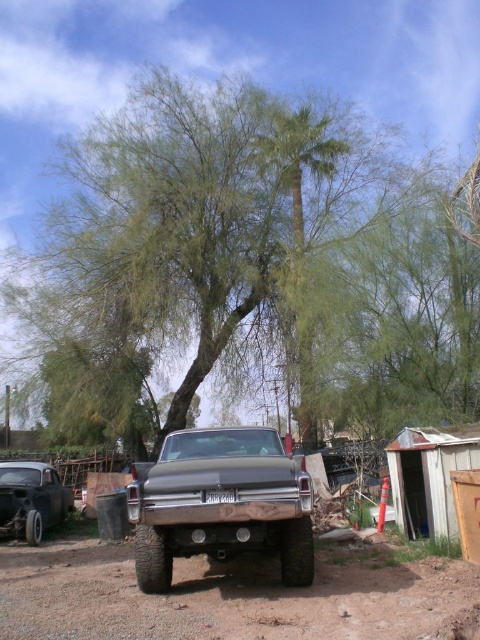
Is matte black truck at center shorter than metal/wooden hut at lower right?

Yes, matte black truck at center is shorter than metal/wooden hut at lower right.

Is matte black truck at center thinner than metal/wooden hut at lower right?

No.

Is point (240, 486) behind point (433, 481)?

That is False.

Where is `matte black truck at center`? matte black truck at center is located at coordinates (219, 502).

Is green leafy tree at center above matte black truck at center?

Yes, green leafy tree at center is above matte black truck at center.

Does green leafy tree at center have a greater height compared to matte black truck at center?

Correct, green leafy tree at center is much taller as matte black truck at center.

Where is `green leafy tree at center`? The height and width of the screenshot is (640, 480). green leafy tree at center is located at coordinates (244, 266).

Which is in front, point (320, 221) or point (435, 502)?

Positioned in front is point (435, 502).

What do you see at coordinates (244, 266) in the screenshot?
I see `green leafy tree at center` at bounding box center [244, 266].

This screenshot has height=640, width=480. I want to click on green leafy tree at center, so click(244, 266).